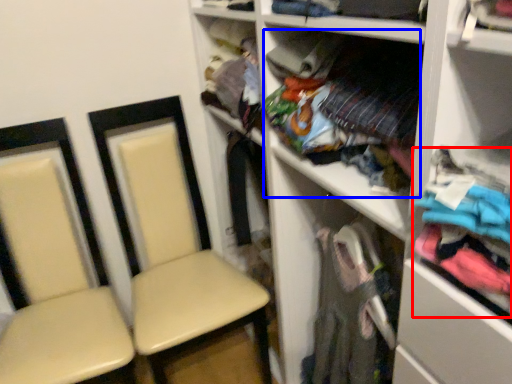
Question: Which of the following is the farthest to the observer, clothing (highlighted by a red box) or clothing (highlighted by a blue box)?

Choices:
 (A) clothing
 (B) clothing

Answer: (B)